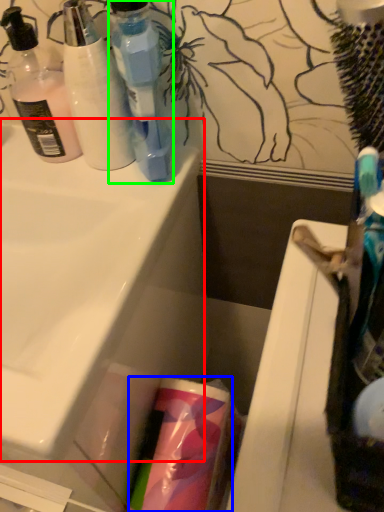
Question: Which object is the closest to the sink (highlighted by a red box)? Choose among these: cleaning product (highlighted by a blue box) or bottle (highlighted by a green box).

Choices:
 (A) cleaning product
 (B) bottle

Answer: (B)